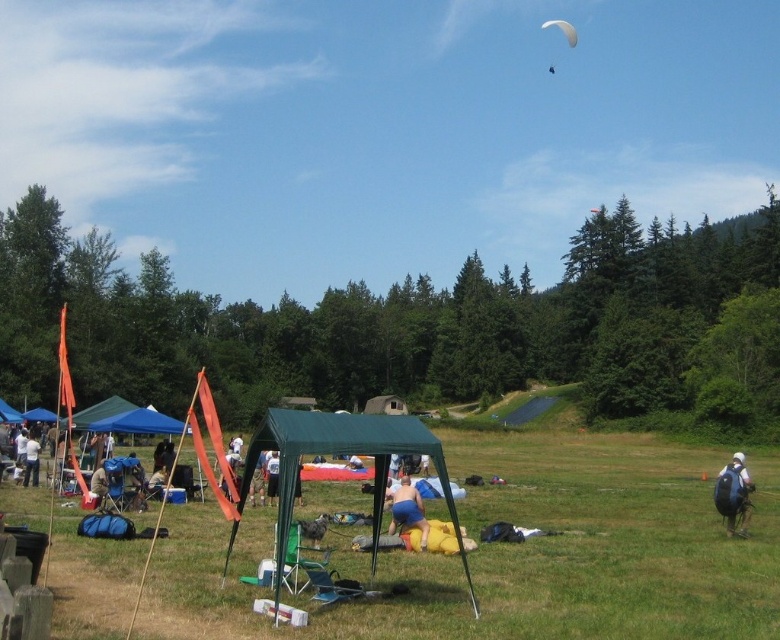
Question: Which of the following is the farthest from the observer?

Choices:
 (A) blue fabric at center
 (B) black matte backpack at lower right

Answer: (B)

Question: Is blue fabric at center further to camera compared to light blue fabric at lower left?

Choices:
 (A) no
 (B) yes

Answer: (A)

Question: Does blue fabric tent at center have a greater width compared to blue fabric canopy at lower left?

Choices:
 (A) no
 (B) yes

Answer: (A)

Question: Is light blue fabric at lower left below blue fabric tent at center?

Choices:
 (A) no
 (B) yes

Answer: (B)

Question: Which point is closer to the camera?

Choices:
 (A) (2, 412)
 (B) (34, 464)

Answer: (B)

Question: Considering the real-world distances, which object is closest to the white matte parachute at upper center?

Choices:
 (A) black matte backpack at lower right
 (B) green fabric tent at center
 (C) blue fabric tent at center
 (D) blue fabric canopy at lower left

Answer: (A)